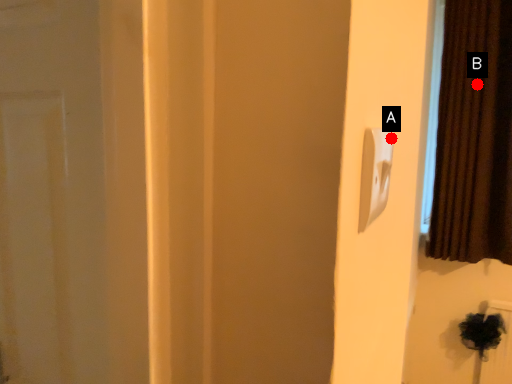
Question: Two points are circled on the image, labeled by A and B beside each circle. Which point is further to the camera?

Choices:
 (A) A is further
 (B) B is further

Answer: (B)